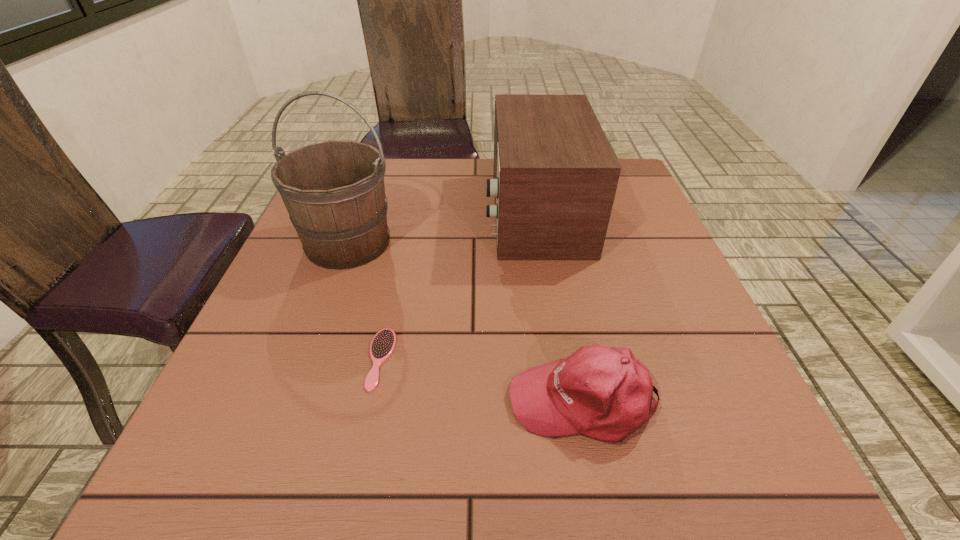
I want to click on free area in between the second tallest object and the hairbrush, so click(458, 286).

Image resolution: width=960 pixels, height=540 pixels. I want to click on empty location between the bucket and the radio receiver, so click(442, 228).

Identify which object is located as the nearest to the baseball cap. Please provide its 2D coordinates. Your answer should be formatted as a tuple, i.e. [(x, y)], where the tuple contains the x and y coordinates of a point satisfying the conditions above.

[(383, 343)]

Locate which object ranks second in proximity to the hairbrush. Please provide its 2D coordinates. Your answer should be formatted as a tuple, i.e. [(x, y)], where the tuple contains the x and y coordinates of a point satisfying the conditions above.

[(604, 393)]